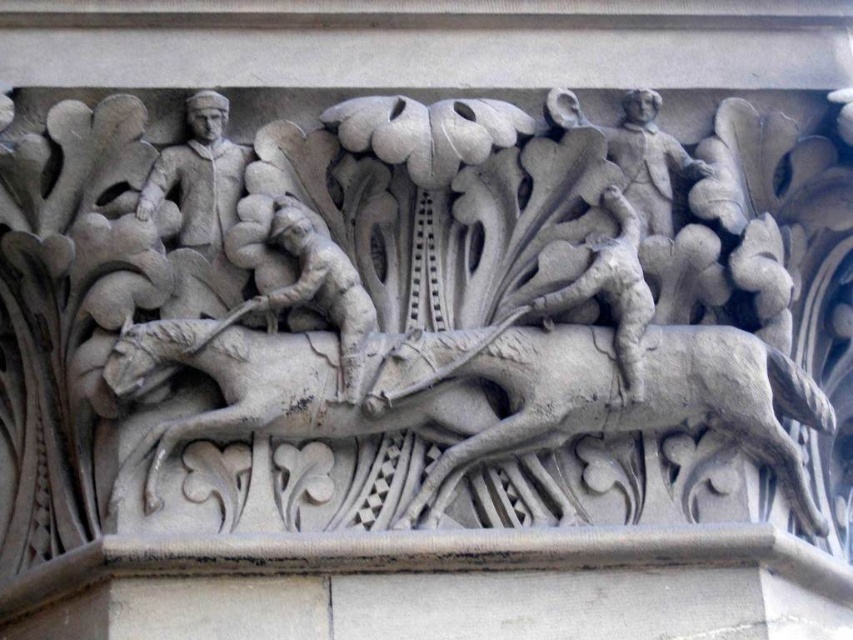
This screenshot has height=640, width=853. Describe the element at coordinates (480, 394) in the screenshot. I see `gray stone horse at center` at that location.

Locate an element on the screen. gray stone horse at center is located at coordinates (480, 394).

Looking at this image, does stone horse at center have a lesser width compared to gray stone figure at center?

No, stone horse at center is not thinner than gray stone figure at center.

Can you confirm if stone horse at center is positioned below gray stone figure at center?

No.

Which is in front, point (682, 272) or point (265, 256)?

Positioned in front is point (265, 256).

Where is `stone horse at center`? stone horse at center is located at coordinates (486, 328).

The width and height of the screenshot is (853, 640). What are the coordinates of `stone horse at center` in the screenshot? It's located at (486, 328).

Is stone horse at center above gray stone horse at center?

Correct, stone horse at center is located above gray stone horse at center.

You are a GUI agent. You are given a task and a screenshot of the screen. Output one action in this format:
    pyautogui.click(x=<x>, y=<y>)
    Task: Click on the stone horse at center
    This screenshot has height=640, width=853.
    Given the screenshot: What is the action you would take?
    pyautogui.click(x=486, y=328)

The width and height of the screenshot is (853, 640). Find the location of `stone horse at center`. stone horse at center is located at coordinates pyautogui.click(x=486, y=328).